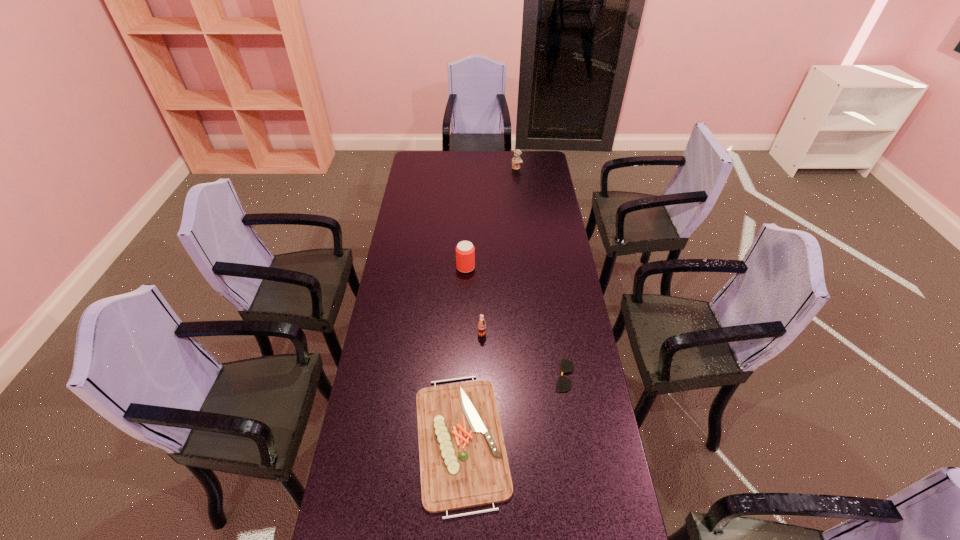
Locate an element on the screen. vacant space located on the right of the fourth tallest object is located at coordinates (556, 440).

In order to click on vacant space located 0.270m on the left of the shortest object in this screenshot , I will do `click(475, 375)`.

Find the location of a particular element. The height and width of the screenshot is (540, 960). object that is at the far edge is located at coordinates (516, 160).

Identify the location of teddy bear located in the right edge section of the desktop. (516, 160).

At what (x,y) coordinates should I click in order to perform the action: click on spectacles that is at the right edge. Please return your answer as a coordinate pair (x, y). The width and height of the screenshot is (960, 540). Looking at the image, I should click on (563, 384).

Identify the location of object that is positioned at the far right corner. (516, 160).

Find the location of a particular element. blank space at the far edge of the desktop is located at coordinates (475, 159).

What are the coordinates of `vacant space at the left edge of the desktop` in the screenshot? It's located at 413,222.

Identify the location of free space at the right edge of the desktop. (577, 352).

This screenshot has width=960, height=540. Find the location of `free region at the far left corner`. free region at the far left corner is located at coordinates (417, 161).